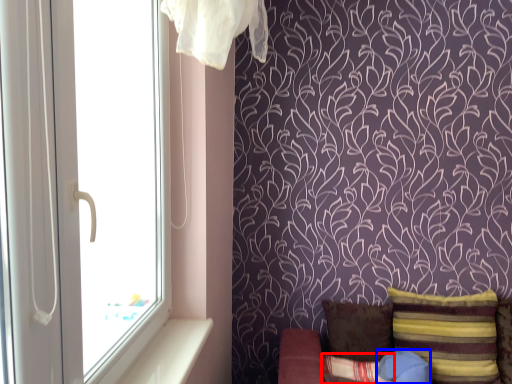
Question: Among these objects, which one is nearest to the camera, pillow (highlighted by a red box) or pillow (highlighted by a blue box)?

Choices:
 (A) pillow
 (B) pillow

Answer: (A)